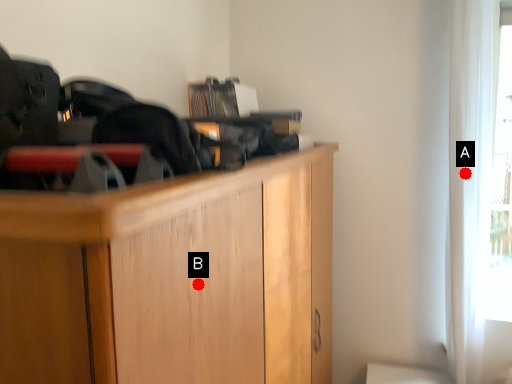
Question: Two points are circled on the image, labeled by A and B beside each circle. Among these points, which one is nearest to the camera?

Choices:
 (A) A is closer
 (B) B is closer

Answer: (B)